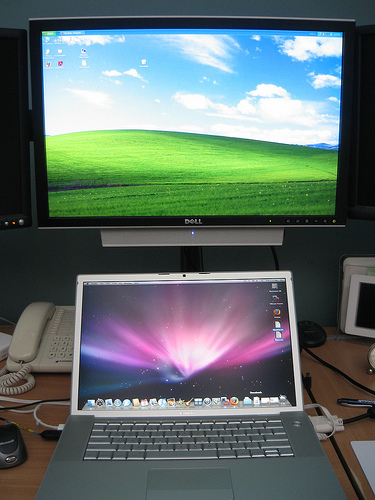
The width and height of the screenshot is (375, 500). I want to click on power light, so click(x=193, y=232).